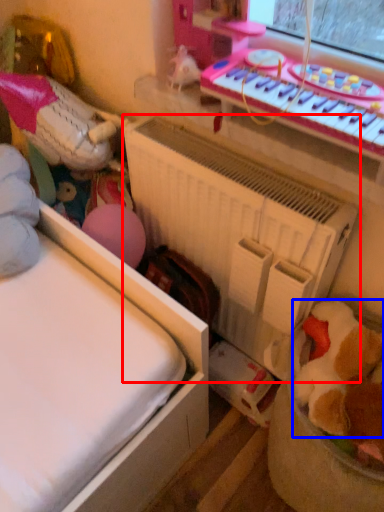
Question: Which point is further to the camera, radiator (highlighted by a red box) or toy (highlighted by a blue box)?

Choices:
 (A) radiator
 (B) toy

Answer: (A)